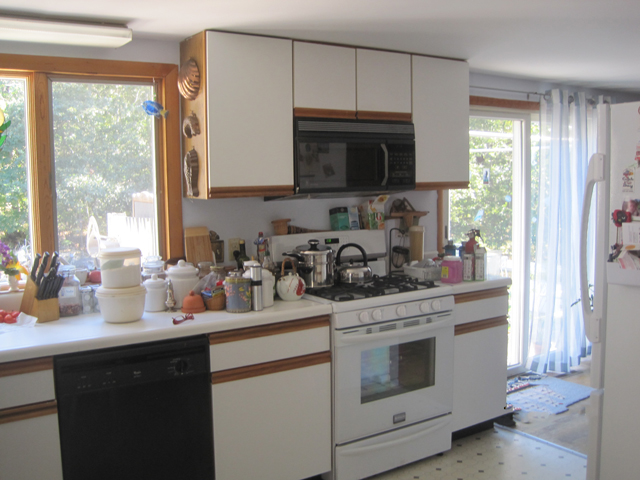
Identify the location of wall. This screenshot has width=640, height=480. (267, 220).